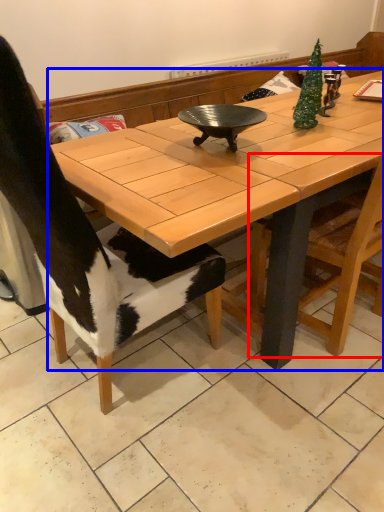
Question: Which of the following is the closest to the observer, chair (highlighted by a red box) or coffee table (highlighted by a blue box)?

Choices:
 (A) chair
 (B) coffee table

Answer: (B)